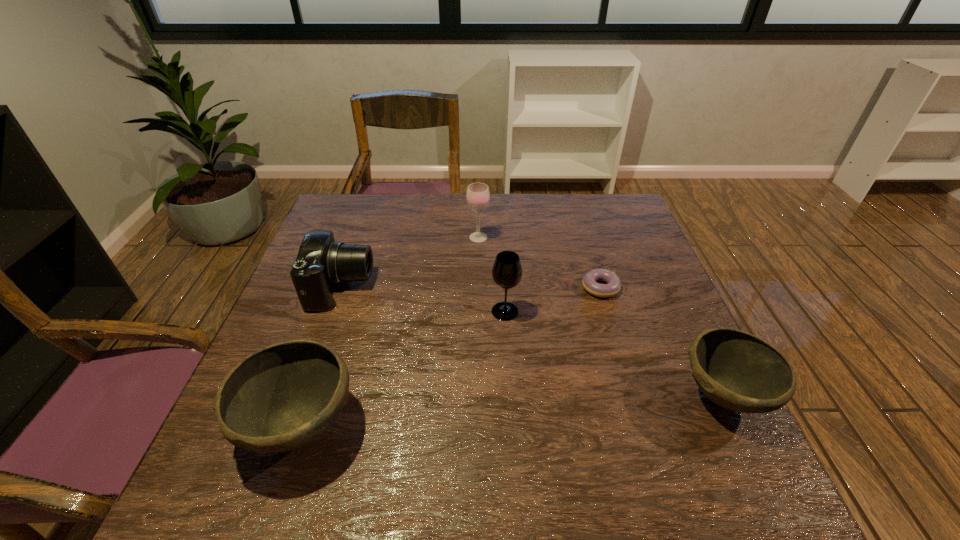
The width and height of the screenshot is (960, 540). Find the location of `blank space located on the right of the farther wineglass`. blank space located on the right of the farther wineglass is located at coordinates (523, 237).

The height and width of the screenshot is (540, 960). I want to click on free space located on the lens of the camera, so click(501, 287).

Identify the location of vacant region located 0.260m on the front of the nearer wineglass. (512, 418).

Locate an element on the screen. blank area located 0.070m on the front of the fifth object from left to right is located at coordinates (611, 321).

The image size is (960, 540). I want to click on object that is at the far edge, so click(x=478, y=195).

You are a GUI agent. You are given a task and a screenshot of the screen. Output one action in this format:
    pyautogui.click(x=<x>, y=<y>)
    Task: Click on the bowl present at the left edge
    The height and width of the screenshot is (540, 960).
    Given the screenshot: What is the action you would take?
    pyautogui.click(x=281, y=397)

At what (x,y) coordinates should I click in order to perform the action: click on camera located at the left edge. Please return your answer as a coordinate pair (x, y). The width and height of the screenshot is (960, 540). Looking at the image, I should click on (321, 262).

Where is `bowl situated at the right edge`? The width and height of the screenshot is (960, 540). bowl situated at the right edge is located at coordinates (736, 370).

Locate an element on the screen. doughnut at the right edge is located at coordinates (613, 286).

The image size is (960, 540). What are the coordinates of `object present at the near left corner` in the screenshot? It's located at (281, 397).